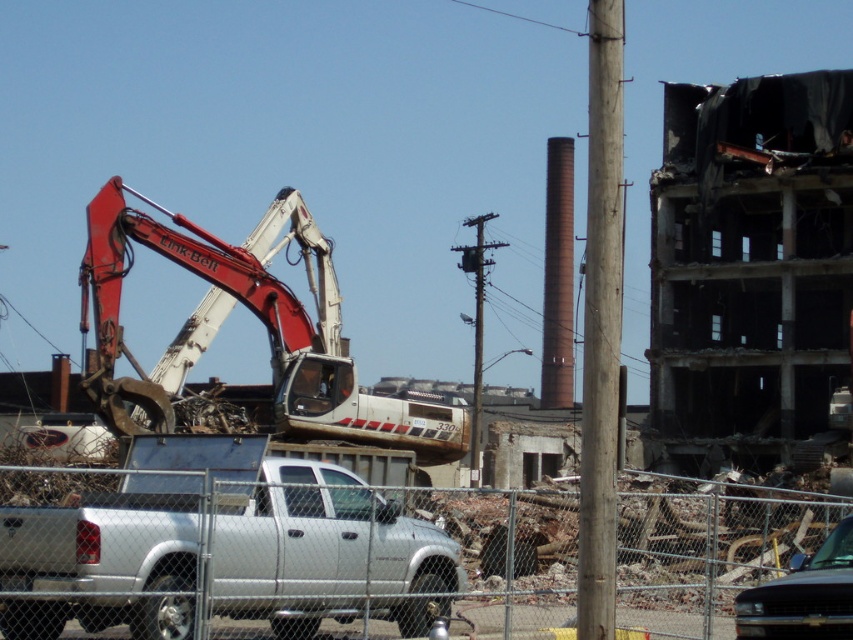
You are standing at the point labeled point (607, 122) and want to walk to the point labeled point (810, 561). Which direction should you face to walk towards your destination?

You should face towards the direction of point (810, 561) since point (607, 122) is in front of it, meaning the destination is behind your current position.

You are a safety inspector at the construction site. You notice the silver metallic truck at center and the shiny black car at lower right. Are there any safety concerns regarding their current positions?

Yes, the silver metallic truck at center is positioned over the shiny black car at lower right, which could pose a safety hazard due to potential crushing or blocking access in case of an emergency.